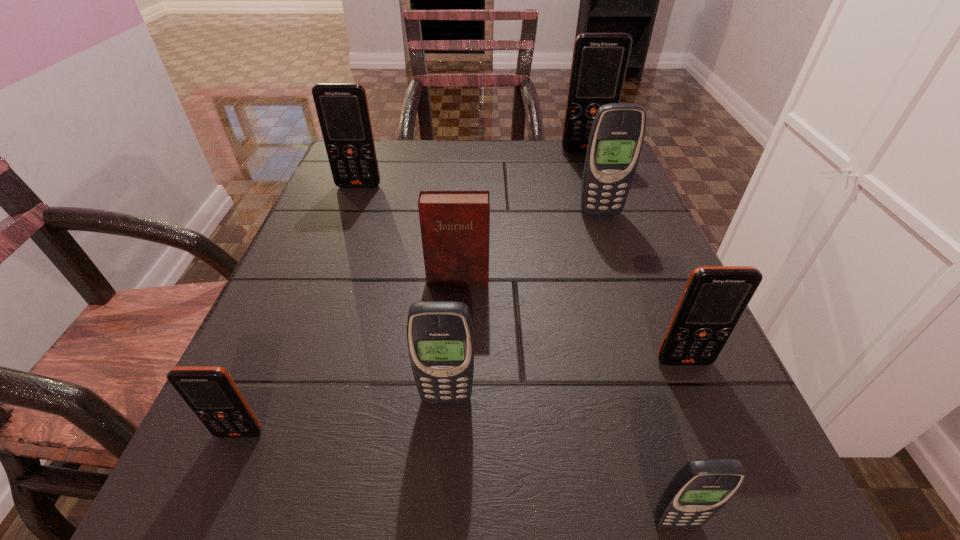
In order to click on the tallest object in this screenshot , I will do `click(599, 63)`.

Find the location of a particular element. The height and width of the screenshot is (540, 960). the tallest cellular telephone is located at coordinates (599, 63).

Locate an element on the screen. Image resolution: width=960 pixels, height=540 pixels. the second farthest orange cellular telephone is located at coordinates (342, 108).

Locate an element on the screen. This screenshot has height=540, width=960. the second farthest object is located at coordinates (342, 108).

Locate an element on the screen. This screenshot has width=960, height=540. the farthest gray cellular telephone is located at coordinates (617, 133).

Locate an element on the screen. The image size is (960, 540). the third farthest object is located at coordinates (617, 133).

In order to click on the second farthest gray cellular telephone in this screenshot , I will do `click(440, 336)`.

What are the coordinates of `the second smallest gray cellular telephone` in the screenshot? It's located at (440, 336).

You are a GUI agent. You are given a task and a screenshot of the screen. Output one action in this format:
    pyautogui.click(x=<x>, y=<y>)
    Task: Click on the third farthest orange cellular telephone
    Image resolution: width=960 pixels, height=540 pixels.
    Given the screenshot: What is the action you would take?
    pyautogui.click(x=715, y=297)

Locate an element on the screen. This screenshot has height=540, width=960. the fourth nearest object is located at coordinates (715, 297).